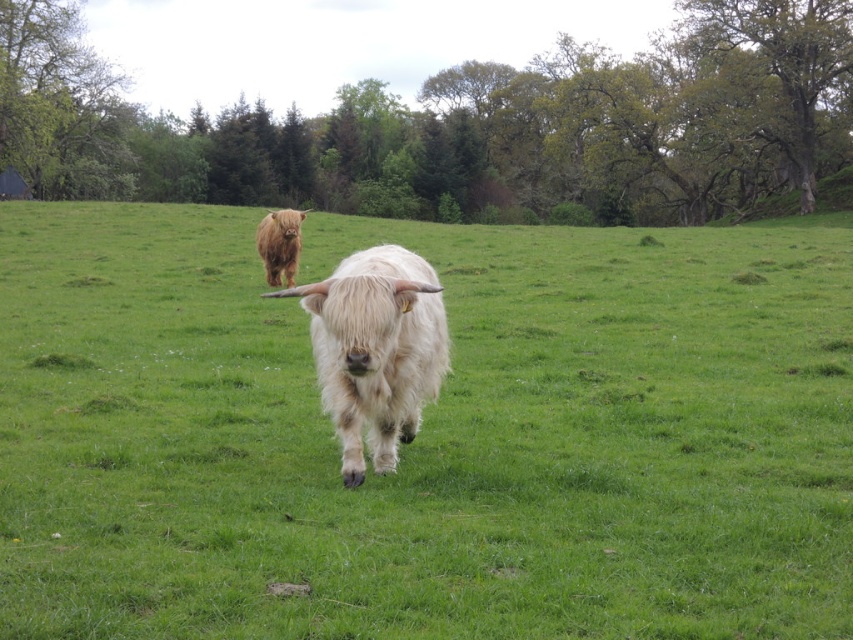
Looking at this image, you are a photographer trying to capture the brown fuzzy cow at center. You notice the green grass at center is blocking your view. Can you move the grass to get a clear shot?

The green grass at center is positioned under the brown fuzzy cow at center, so you cannot move the grass as it is beneath the cow, making it impossible to obstruct your view.

You are a photographer trying to capture both the green grass at center and the brown fuzzy cow at center in a single shot. Based on their positions, which one will appear larger in your photo?

The green grass at center will appear larger in the photo because it is closer to the viewer than the brown fuzzy cow at center.